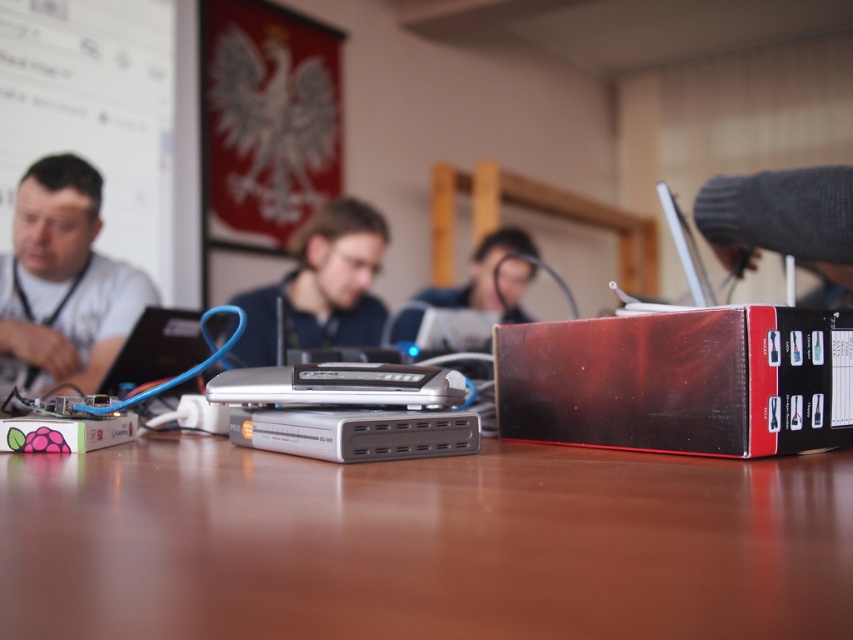
You are a technician standing in front of the workspace. You need to locate two specific points marked in the image. The first point is at coordinates point (41, 211), and the second point is at point (229, 330). Which point is closer to you?

Point (41, 211) is further to the camera than point (229, 330), so the second point is closer to you.

You are a technician in a workshop and need to place a tool on the brown wooden table at center and the smooth plastic face at center. Which surface will the tool be closer to your hand if you reach out from your current position?

The brown wooden table at center is closer to the viewer than the smooth plastic face at center, so placing the tool there will make it closer to your hand.